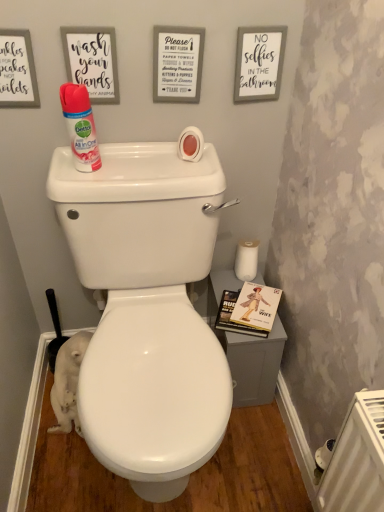
Identify the location of free spot in front of matte pink spray can at upper left. The width and height of the screenshot is (384, 512). (86, 183).